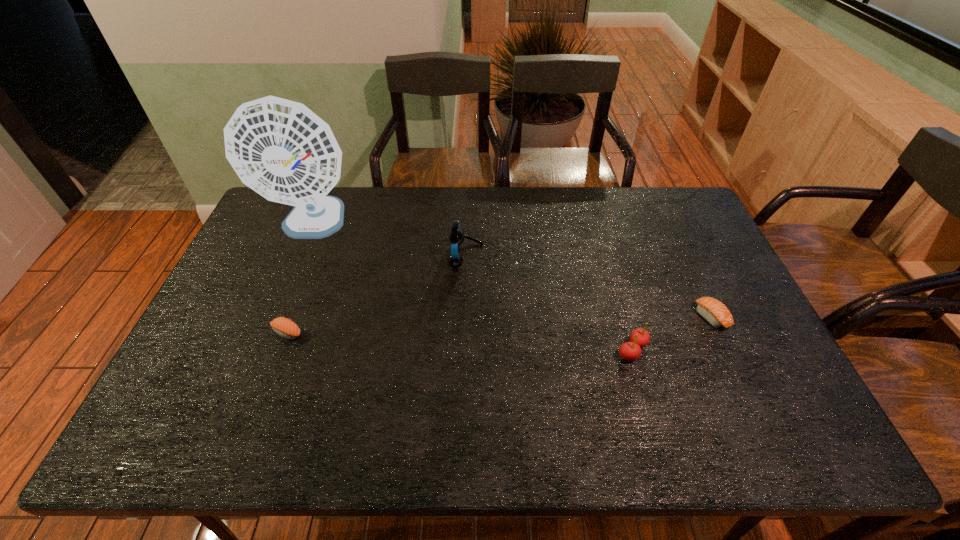
Where is `vacant space at the far right corner`? vacant space at the far right corner is located at coordinates (679, 223).

Locate an element on the screen. This screenshot has width=960, height=540. free space that is in between the left sushi and the cherry is located at coordinates (460, 341).

This screenshot has height=540, width=960. I want to click on vacant space in between the third object from left to right and the second object from right to left, so click(x=549, y=303).

At what (x,y) coordinates should I click in order to perform the action: click on unoccupied area between the fan and the third object from left to right. Please return your answer as a coordinate pair (x, y). Image resolution: width=960 pixels, height=540 pixels. Looking at the image, I should click on (390, 241).

Locate an element on the screen. The width and height of the screenshot is (960, 540). free space between the fan and the third tallest object is located at coordinates (472, 288).

Where is `vacant region between the cherry and the fan`? The image size is (960, 540). vacant region between the cherry and the fan is located at coordinates (472, 288).

You are a GUI agent. You are given a task and a screenshot of the screen. Output one action in this format:
    pyautogui.click(x=<x>, y=<y>)
    Task: Click on the unoccupied area between the right sushi and the left sushi
    
    Given the screenshot: What is the action you would take?
    pyautogui.click(x=499, y=325)

Find the location of a particular element. Image resolution: width=960 pixels, height=540 pixels. free space between the left sushi and the tallest object is located at coordinates (300, 279).

Image resolution: width=960 pixels, height=540 pixels. I want to click on free area in between the fan and the rightmost object, so click(x=512, y=271).

I want to click on vacant space that's between the headset and the rightmost object, so click(588, 286).